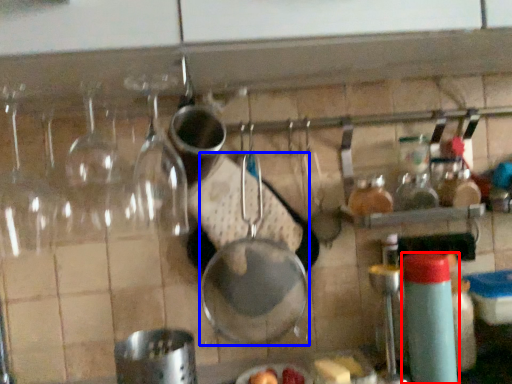
Question: Which of the following is the farthest to the observer, bottle (highlighted by a red box) or frying pan (highlighted by a blue box)?

Choices:
 (A) bottle
 (B) frying pan

Answer: (B)